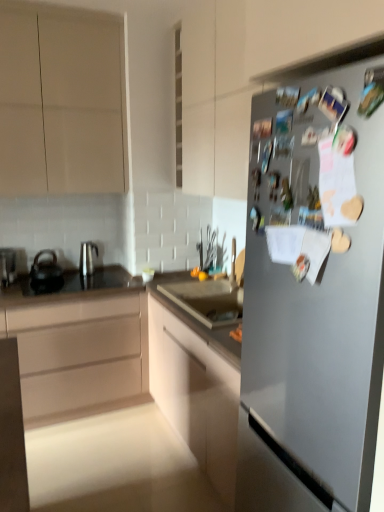
Question: From the image's perspective, does black matte tea pot at left, acting as the 2th tea pot starting from the right, appear higher than black glass countertop at center?

Choices:
 (A) no
 (B) yes

Answer: (B)

Question: Considering the relative sizes of black matte tea pot at left, acting as the 2th tea pot starting from the right, and black glass countertop at center in the image provided, is black matte tea pot at left, acting as the 2th tea pot starting from the right, taller than black glass countertop at center?

Choices:
 (A) no
 (B) yes

Answer: (B)

Question: Considering the relative sizes of black matte tea pot at left, acting as the 2th tea pot starting from the right, and black glass countertop at center in the image provided, is black matte tea pot at left, acting as the 2th tea pot starting from the right, bigger than black glass countertop at center?

Choices:
 (A) yes
 (B) no

Answer: (B)

Question: Does black matte tea pot at left, acting as the first tea pot starting from the left, have a lesser height compared to black glass countertop at center?

Choices:
 (A) no
 (B) yes

Answer: (A)

Question: Is black matte tea pot at left, acting as the 2th tea pot starting from the right, further to the viewer compared to black glass countertop at center?

Choices:
 (A) yes
 (B) no

Answer: (A)

Question: Is black glass countertop at center taller or shorter than matte beige cabinet at left, placed as the second cabinetry when sorted from bottom to top?

Choices:
 (A) short
 (B) tall

Answer: (A)

Question: From the image's perspective, is black glass countertop at center above or below matte beige cabinet at left, placed as the second cabinetry when sorted from bottom to top?

Choices:
 (A) above
 (B) below

Answer: (A)

Question: Is black glass countertop at center inside the boundaries of matte beige cabinet at left, marked as the 2th cabinetry in a top-to-bottom arrangement, or outside?

Choices:
 (A) outside
 (B) inside

Answer: (B)

Question: Is black glass countertop at center to the left or to the right of matte beige cabinet at left, marked as the 2th cabinetry in a top-to-bottom arrangement, in the image?

Choices:
 (A) left
 (B) right

Answer: (B)

Question: Based on their positions, is black matte tea pot at left, acting as the first tea pot starting from the left, located to the left or right of matte white cabinet at center, the third cabinetry positioned from the top?

Choices:
 (A) left
 (B) right

Answer: (A)

Question: Does point (49, 286) appear closer or farther from the camera than point (142, 329)?

Choices:
 (A) closer
 (B) farther

Answer: (A)

Question: From a real-world perspective, relative to matte white cabinet at center, the 1th cabinetry from the bottom, is black matte tea pot at left, acting as the 2th tea pot starting from the right, vertically above or below?

Choices:
 (A) below
 (B) above

Answer: (B)

Question: From their relative heights in the image, would you say black matte tea pot at left, acting as the first tea pot starting from the left, is taller or shorter than matte white cabinet at center, the third cabinetry positioned from the top?

Choices:
 (A) short
 (B) tall

Answer: (A)

Question: From a real-world perspective, is black glass countertop at center above or below metallic silver kettle at left?

Choices:
 (A) below
 (B) above

Answer: (A)

Question: Based on their sizes in the image, would you say black glass countertop at center is bigger or smaller than metallic silver kettle at left?

Choices:
 (A) big
 (B) small

Answer: (A)